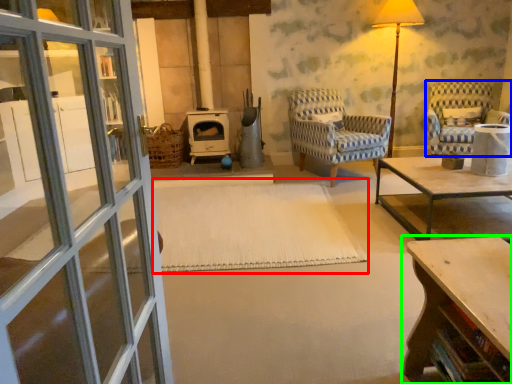
Question: Which object is positioned closest to mat (highlighted by a red box)? Select from chair (highlighted by a blue box) and table (highlighted by a green box).

Choices:
 (A) chair
 (B) table

Answer: (B)